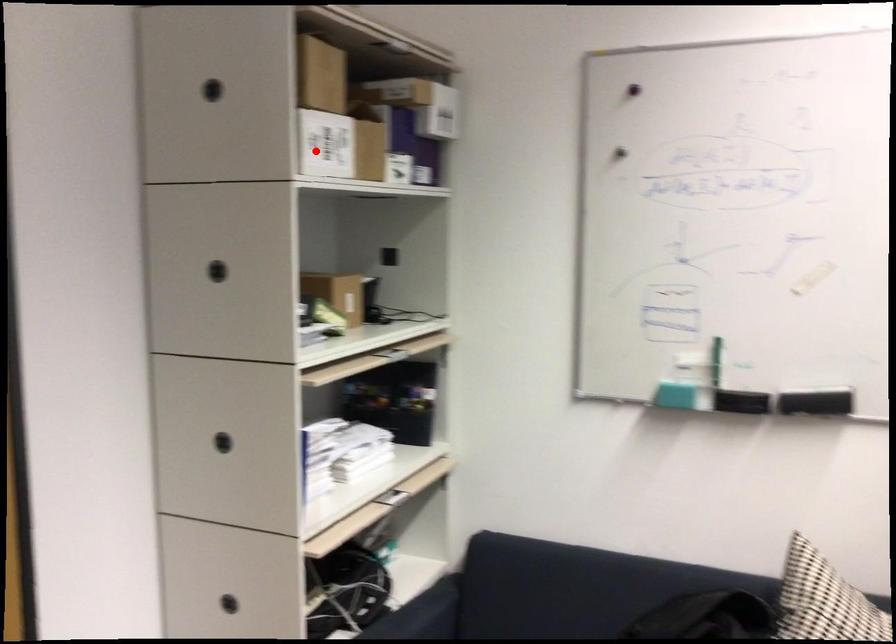
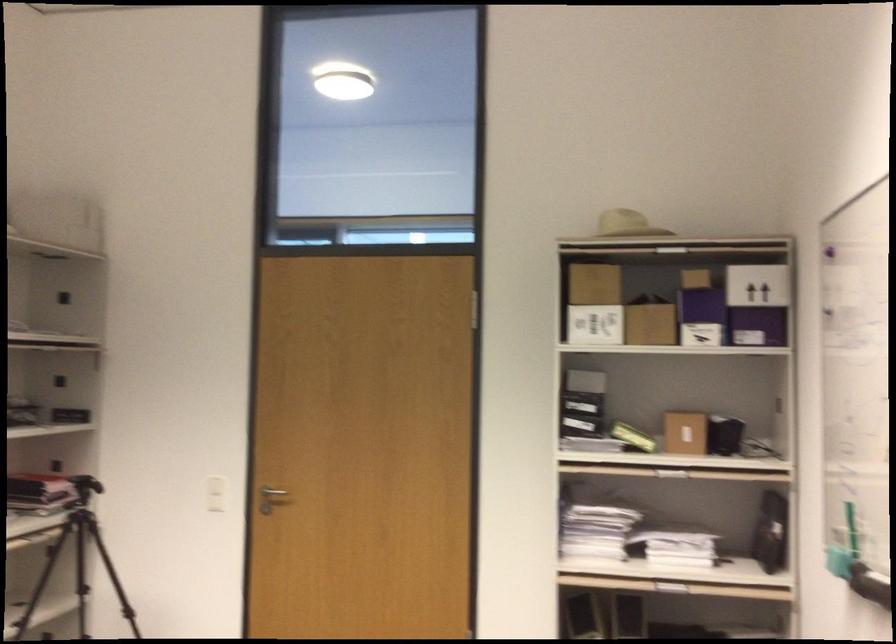
Find the pixel in the second image that matches the highlighted location in the first image.

(595, 325)